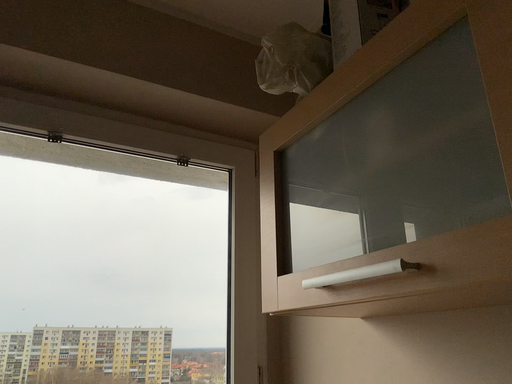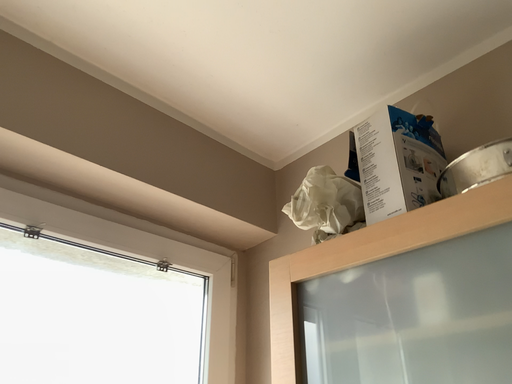
Question: How did the camera likely rotate when shooting the video?

Choices:
 (A) rotated downward
 (B) rotated upward

Answer: (B)